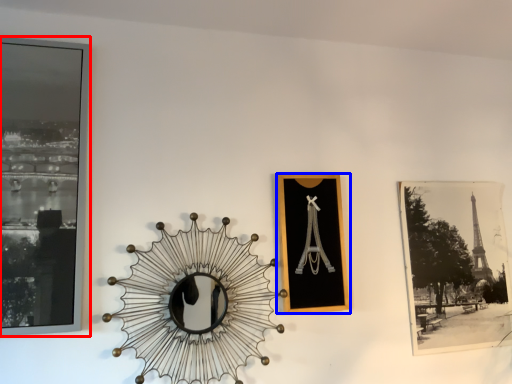
Question: Which object is further to the camera taking this photo, picture frame (highlighted by a red box) or picture frame (highlighted by a blue box)?

Choices:
 (A) picture frame
 (B) picture frame

Answer: (B)